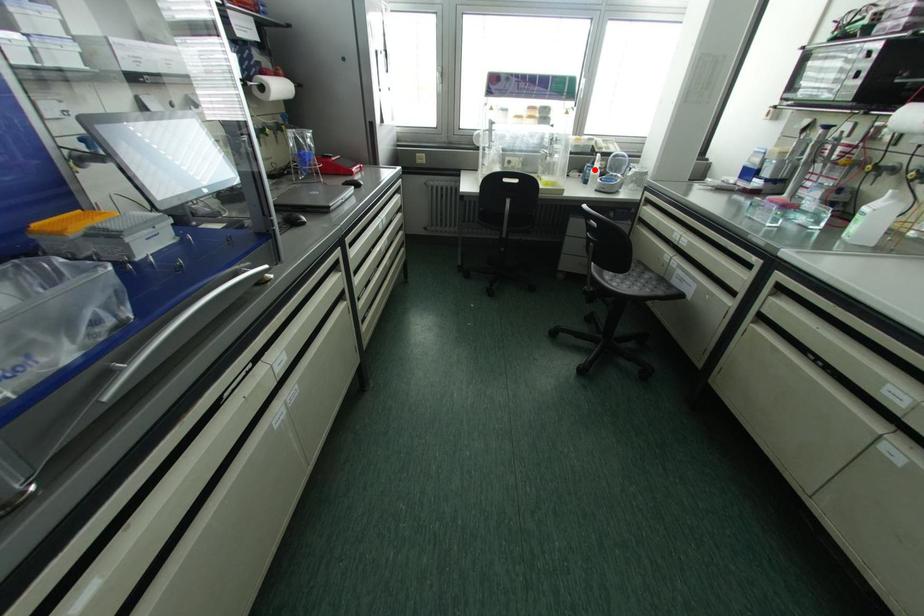
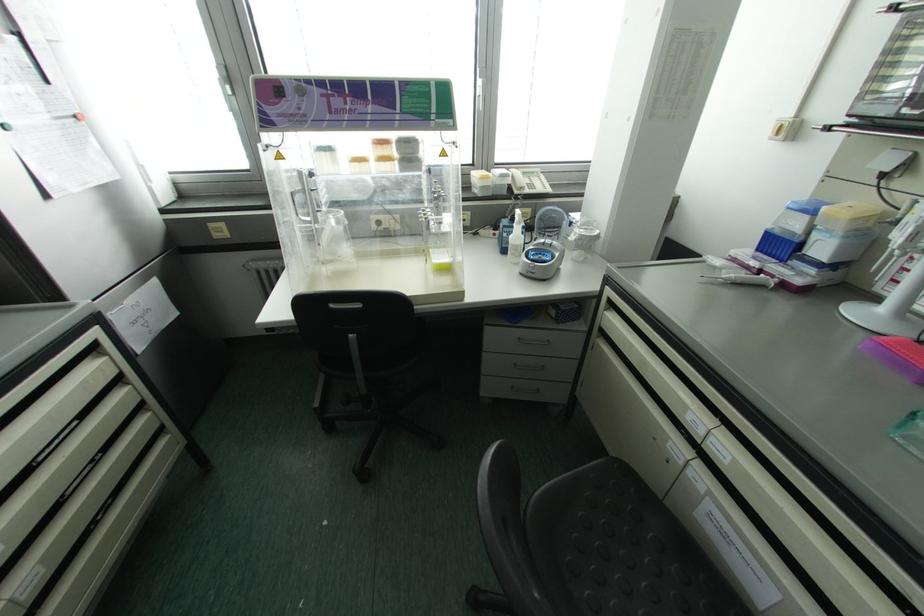
In the second image, find the point that corresponds to the highlighted location in the first image.

(516, 235)